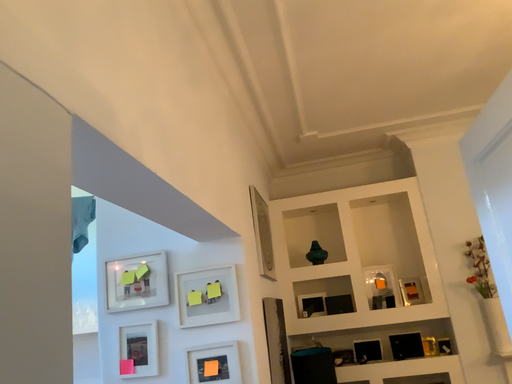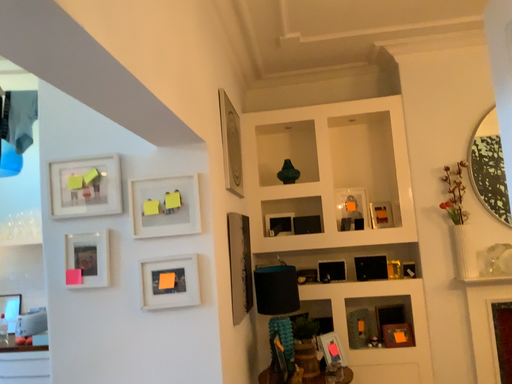
Question: How did the camera likely rotate when shooting the video?

Choices:
 (A) rotated downward
 (B) rotated upward

Answer: (A)